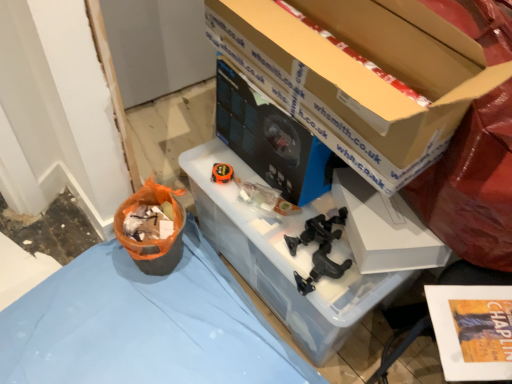
Question: Considering the relative sizes of black plastic clamps at center, the second toy when ordered from top to bottom, and clear plastic storage box at center in the image provided, is black plastic clamps at center, the second toy when ordered from top to bottom, smaller than clear plastic storage box at center?

Choices:
 (A) yes
 (B) no

Answer: (A)

Question: Is black plastic clamps at center, positioned as the first toy in right-to-left order, to the right of clear plastic storage box at center from the viewer's perspective?

Choices:
 (A) yes
 (B) no

Answer: (A)

Question: Can you confirm if black plastic clamps at center, positioned as the first toy in right-to-left order, is shorter than clear plastic storage box at center?

Choices:
 (A) yes
 (B) no

Answer: (A)

Question: Does black plastic clamps at center, which ranks as the 2th toy in back-to-front order, contain clear plastic storage box at center?

Choices:
 (A) yes
 (B) no

Answer: (B)

Question: From a real-world perspective, is black plastic clamps at center, the second toy when ordered from top to bottom, beneath clear plastic storage box at center?

Choices:
 (A) no
 (B) yes

Answer: (A)

Question: From a real-world perspective, is orange plastic basket at lower left positioned above or below matte black desktop computer at center?

Choices:
 (A) below
 (B) above

Answer: (A)

Question: In the image, is orange plastic basket at lower left positioned in front of or behind matte black desktop computer at center?

Choices:
 (A) front
 (B) behind

Answer: (B)

Question: Is orange plastic basket at lower left situated inside matte black desktop computer at center or outside?

Choices:
 (A) outside
 (B) inside

Answer: (A)

Question: Is orange plastic basket at lower left bigger or smaller than matte black desktop computer at center?

Choices:
 (A) big
 (B) small

Answer: (B)

Question: Is white matte box at center, acting as the 1th box starting from the bottom, situated inside matte black desktop computer at center or outside?

Choices:
 (A) inside
 (B) outside

Answer: (B)

Question: From their relative heights in the image, would you say white matte box at center, which ranks as the 2th box in top-to-bottom order, is taller or shorter than matte black desktop computer at center?

Choices:
 (A) tall
 (B) short

Answer: (B)

Question: From a real-world perspective, is white matte box at center, which ranks as the 2th box in top-to-bottom order, physically located above or below matte black desktop computer at center?

Choices:
 (A) above
 (B) below

Answer: (B)

Question: Would you say white matte box at center, acting as the 1th box starting from the bottom, is to the left or to the right of matte black desktop computer at center in the picture?

Choices:
 (A) left
 (B) right

Answer: (B)

Question: In the image, is white matte box at center, acting as the 1th box starting from the bottom, on the left side or the right side of black plastic clamps at center, the first toy from the front?

Choices:
 (A) left
 (B) right

Answer: (B)

Question: From the image's perspective, is white matte box at center, which ranks as the 2th box in top-to-bottom order, located above or below black plastic clamps at center, positioned as the first toy in bottom-to-top order?

Choices:
 (A) below
 (B) above

Answer: (B)